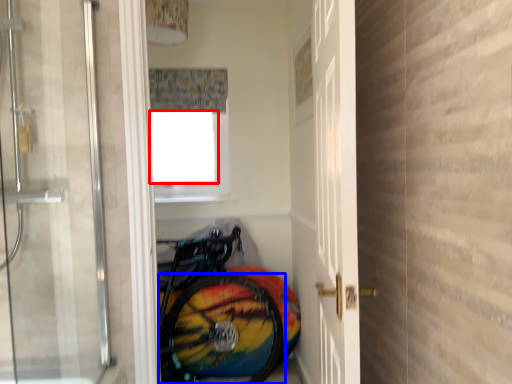
Question: Which object appears farthest to the camera in this image, window screen (highlighted by a red box) or bicycle wheel (highlighted by a blue box)?

Choices:
 (A) window screen
 (B) bicycle wheel

Answer: (A)